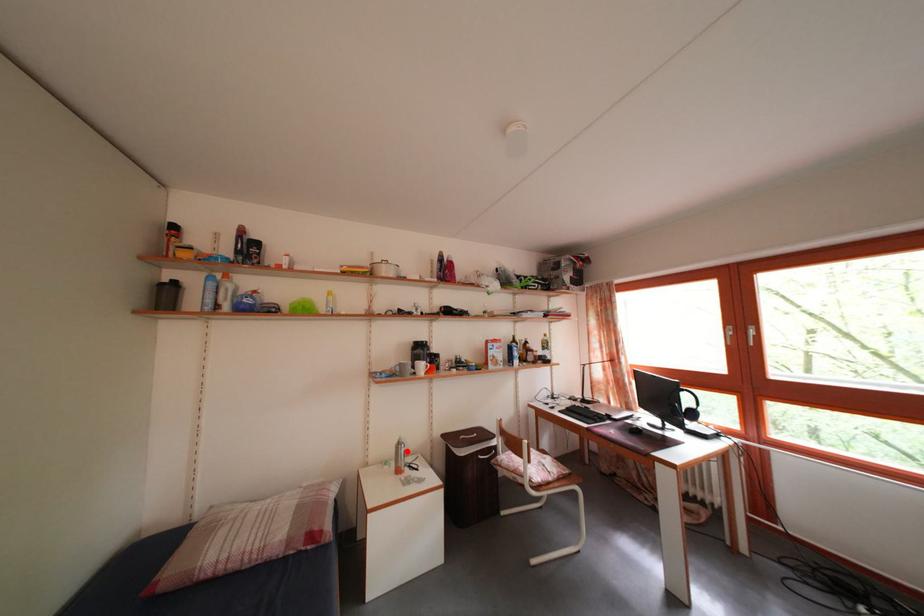
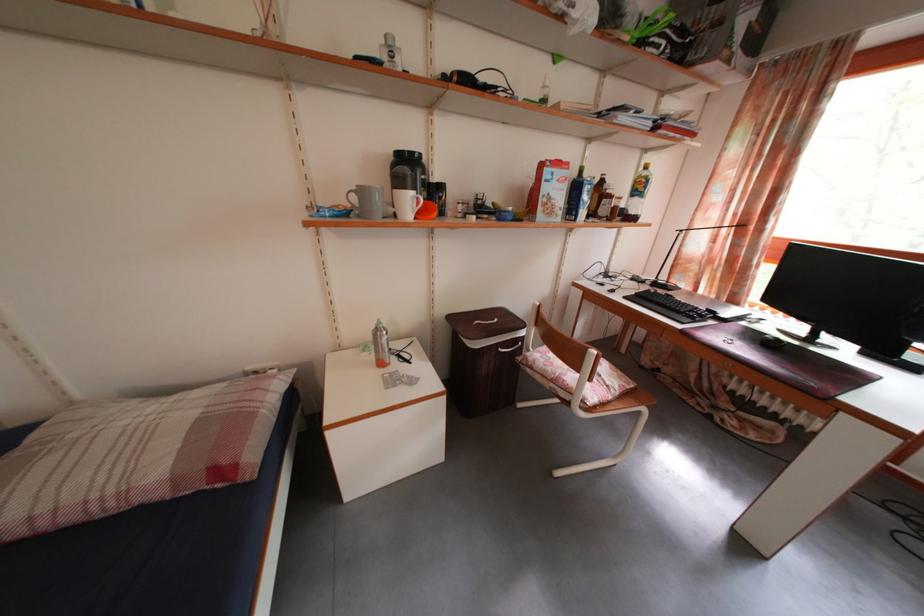
Find the pixel in the second image that matches the highlighted location in the first image.

(384, 338)